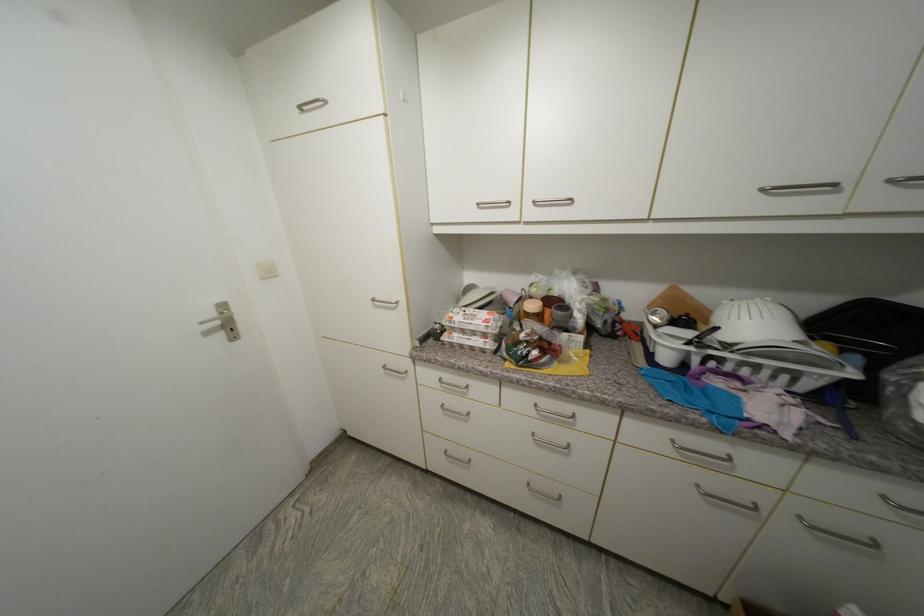
The location [658,315] corresponds to which object?

It refers to a silver beverage can.